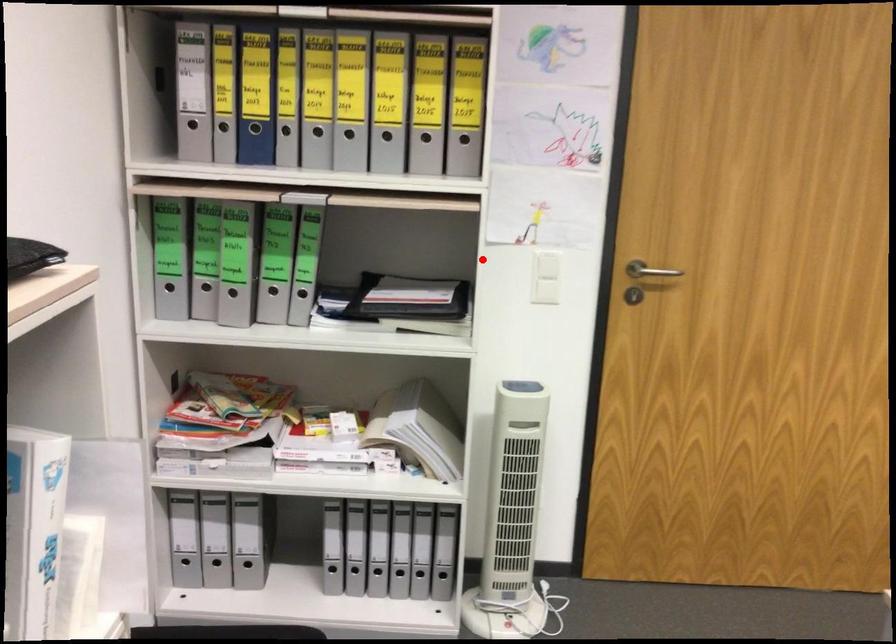
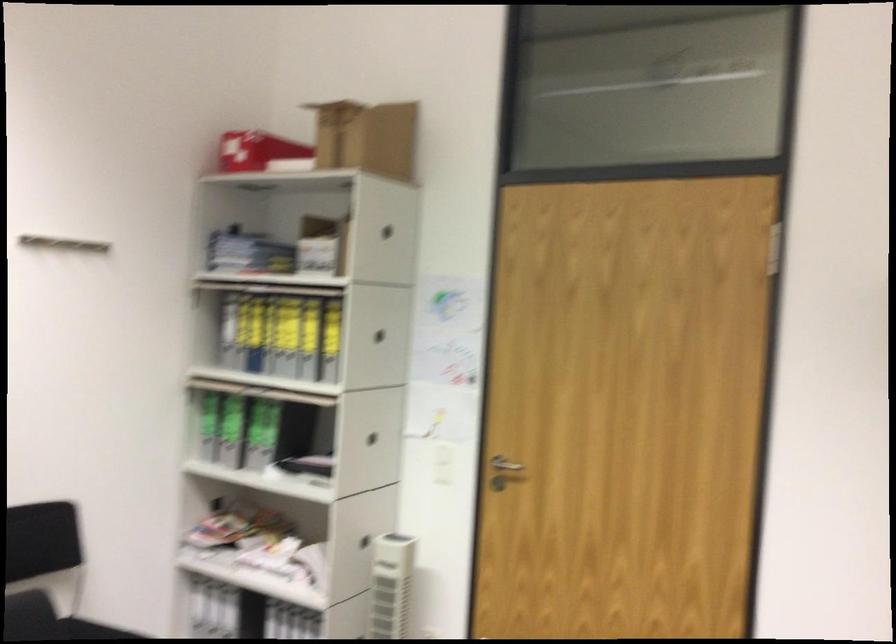
Where in the second image is the point corresponding to the highlighted location from the first image?

(372, 438)